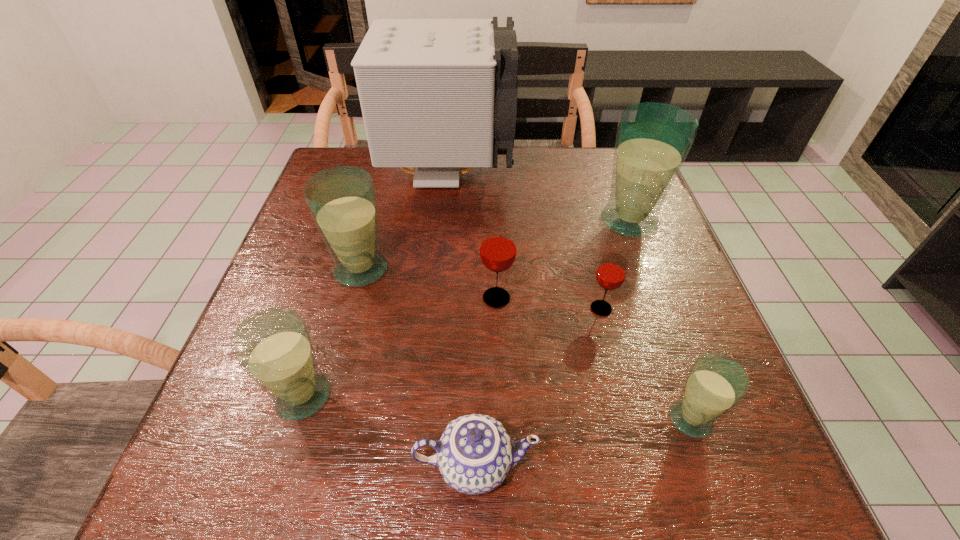
Locate an element on the screen. fan is located at coordinates (437, 96).

The image size is (960, 540). I want to click on the tallest object, so pyautogui.click(x=437, y=96).

The width and height of the screenshot is (960, 540). Identify the location of the biggest blue glass. (653, 139).

Where is `the farthest glass`? The image size is (960, 540). the farthest glass is located at coordinates (653, 139).

Where is `the third nearest blue glass`? The image size is (960, 540). the third nearest blue glass is located at coordinates [x=342, y=200].

The width and height of the screenshot is (960, 540). In order to click on the second biggest blue glass in this screenshot , I will do `click(342, 200)`.

Find the location of a particular element. This screenshot has height=540, width=960. the third glass from left to right is located at coordinates (498, 248).

The height and width of the screenshot is (540, 960). What are the coordinates of `the bigger red glass` in the screenshot? It's located at tap(498, 248).

You are a GUI agent. You are given a task and a screenshot of the screen. Output one action in this format:
    pyautogui.click(x=<x>, y=<y>)
    Task: Click on the second smallest blue glass
    
    Given the screenshot: What is the action you would take?
    pyautogui.click(x=273, y=346)

What are the coordinates of `the smaller red glass` in the screenshot? It's located at (611, 272).